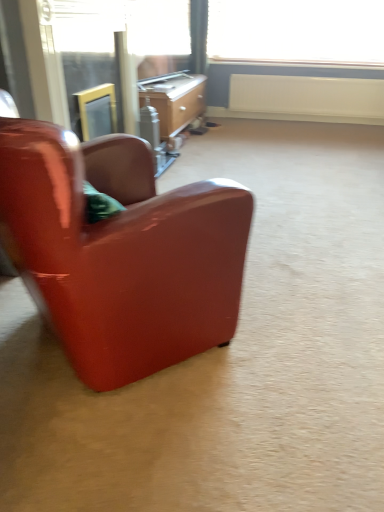
Question: Is wooden desk at center outside glossy leather chair at left?

Choices:
 (A) yes
 (B) no

Answer: (A)

Question: Is the surface of wooden desk at center in direct contact with glossy leather chair at left?

Choices:
 (A) no
 (B) yes

Answer: (A)

Question: Can you confirm if wooden desk at center is wider than glossy leather chair at left?

Choices:
 (A) yes
 (B) no

Answer: (B)

Question: From the image's perspective, is wooden desk at center below glossy leather chair at left?

Choices:
 (A) no
 (B) yes

Answer: (A)

Question: From a real-world perspective, is wooden desk at center physically below glossy leather chair at left?

Choices:
 (A) no
 (B) yes

Answer: (B)

Question: Is white matte radiator at upper center taller or shorter than clear glass screen door at upper left, which is counted as the 1th screen door, starting from the right?

Choices:
 (A) short
 (B) tall

Answer: (A)

Question: From a real-world perspective, relative to clear glass screen door at upper left, positioned as the 2th screen door in left-to-right order, is white matte radiator at upper center vertically above or below?

Choices:
 (A) below
 (B) above

Answer: (A)

Question: Is point (344, 79) closer or farther from the camera than point (127, 105)?

Choices:
 (A) closer
 (B) farther

Answer: (B)

Question: Considering the positions of white matte radiator at upper center and clear glass screen door at upper left, which is counted as the 1th screen door, starting from the right, in the image, is white matte radiator at upper center bigger or smaller than clear glass screen door at upper left, which is counted as the 1th screen door, starting from the right,?

Choices:
 (A) small
 (B) big

Answer: (A)

Question: Is matte glass screen door at upper left, the 2th screen door positioned from the right, to the left or to the right of white matte radiator at upper center in the image?

Choices:
 (A) left
 (B) right

Answer: (A)

Question: From the image's perspective, is matte glass screen door at upper left, the 2th screen door positioned from the right, positioned above or below white matte radiator at upper center?

Choices:
 (A) below
 (B) above

Answer: (A)

Question: In terms of height, does matte glass screen door at upper left, which is counted as the 1th screen door, starting from the left, look taller or shorter compared to white matte radiator at upper center?

Choices:
 (A) tall
 (B) short

Answer: (A)

Question: Relative to white matte radiator at upper center, is matte glass screen door at upper left, which is counted as the 1th screen door, starting from the left, in front or behind?

Choices:
 (A) front
 (B) behind

Answer: (A)

Question: Does point (322, 77) appear closer or farther from the camera than point (102, 287)?

Choices:
 (A) farther
 (B) closer

Answer: (A)

Question: From a real-world perspective, is white matte radiator at upper center above or below glossy leather chair at left?

Choices:
 (A) above
 (B) below

Answer: (B)